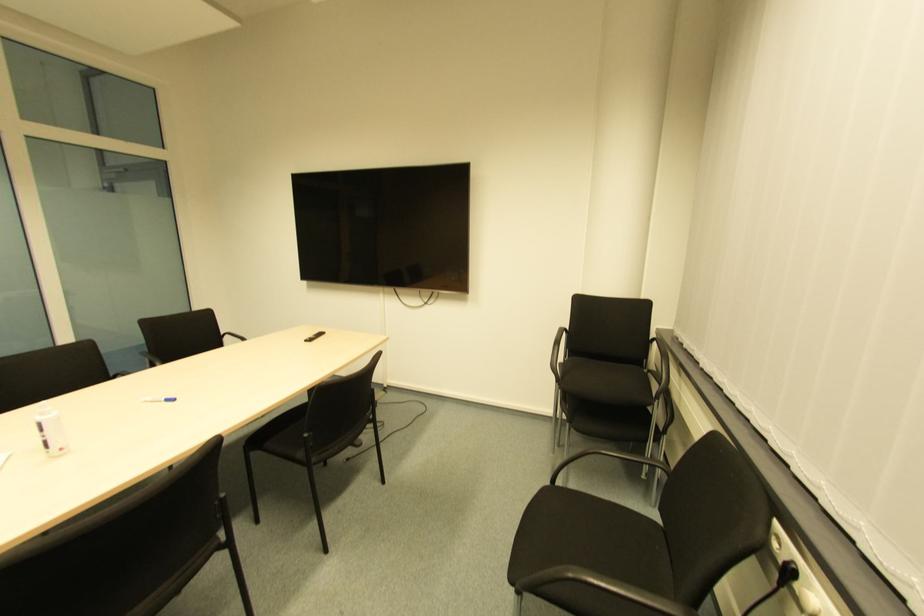
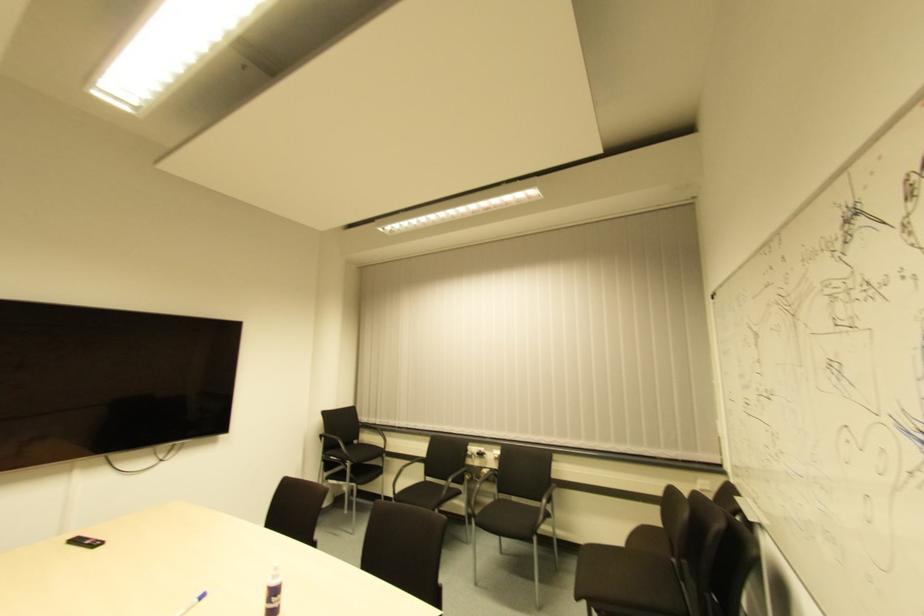
The point at (169, 403) is marked in the first image. Where is the corresponding point in the second image?

(202, 600)